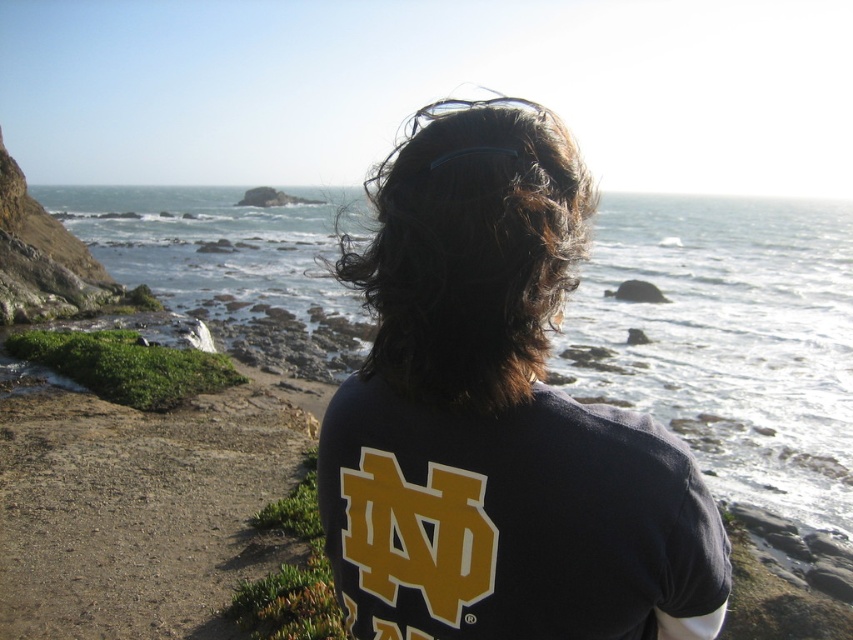
Between dark blue t-shirt at center and dark brown curly hair at center, which one is positioned lower?

Positioned lower is dark blue t-shirt at center.

Is dark blue t-shirt at center positioned in front of dark brown curly hair at center?

Yes, it is in front of dark brown curly hair at center.

This screenshot has height=640, width=853. In order to click on dark blue t-shirt at center in this screenshot , I will do `click(497, 417)`.

Is dark blue jersey at center smaller than dark brown curly hair at center?

Indeed, dark blue jersey at center has a smaller size compared to dark brown curly hair at center.

Between dark blue jersey at center and dark brown curly hair at center, which one appears on the right side from the viewer's perspective?

dark blue jersey at center is more to the right.

Which is behind, point (611, 406) or point (444, 269)?

The point (611, 406) is behind.

The image size is (853, 640). In order to click on dark blue jersey at center in this screenshot , I will do `click(515, 522)`.

Between point (212, 294) and point (398, 474), which one is positioned in front?

Point (398, 474) is more forward.

Looking at this image, which is more to the left, clear water at center or dark blue jersey at center?

dark blue jersey at center

Does point (699, 376) come behind point (677, 637)?

Yes, point (699, 376) is behind point (677, 637).

Where is `clear water at center`? clear water at center is located at coordinates (729, 340).